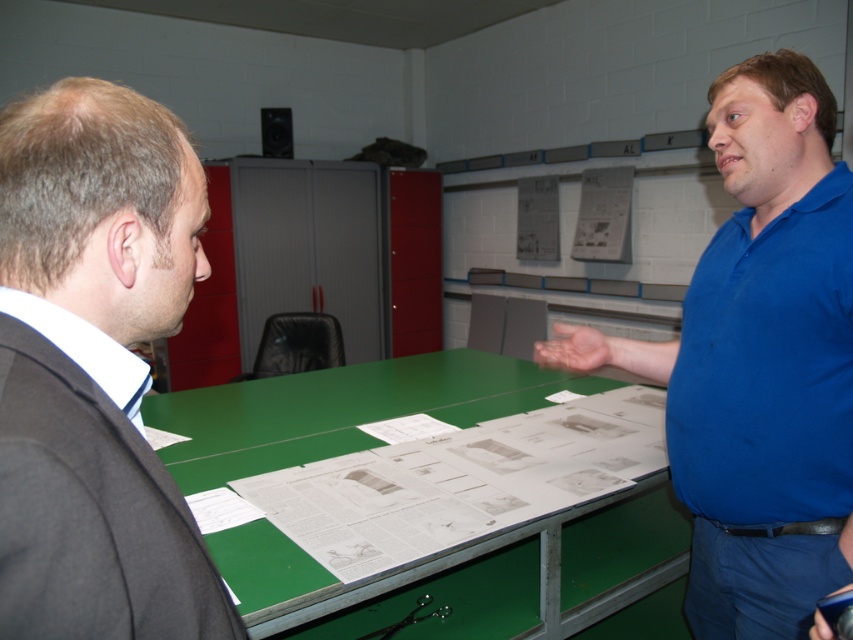
Is dark gray suit at left closer to camera compared to green matte table at center?

That is True.

Looking at this image, which is more to the right, dark gray suit at left or green matte table at center?

dark gray suit at left

I want to click on dark gray suit at left, so click(96, 369).

At what (x,y) coordinates should I click in order to perform the action: click on blue cotton shirt at center. Please return your answer as a coordinate pair (x, y). Looking at the image, I should click on pos(759,362).

Does blue cotton shirt at center appear on the left side of green matte table at center?

No, blue cotton shirt at center is not to the left of green matte table at center.

Is point (749, 547) farther from viewer compared to point (474, 598)?

No, it is not.

You are a GUI agent. You are given a task and a screenshot of the screen. Output one action in this format:
    pyautogui.click(x=<x>, y=<y>)
    Task: Click on the blue cotton shirt at center
    This screenshot has width=853, height=640.
    Given the screenshot: What is the action you would take?
    pyautogui.click(x=759, y=362)

Looking at this image, does dark gray suit at left appear on the right side of blue cotton shirt at center?

Incorrect, dark gray suit at left is not on the right side of blue cotton shirt at center.

Is dark gray suit at left to the left of blue cotton shirt at center from the viewer's perspective?

Indeed, dark gray suit at left is positioned on the left side of blue cotton shirt at center.

Does point (30, 360) come in front of point (766, 260)?

Yes, point (30, 360) is in front of point (766, 260).

Locate an element on the screen. The image size is (853, 640). dark gray suit at left is located at coordinates (96, 369).